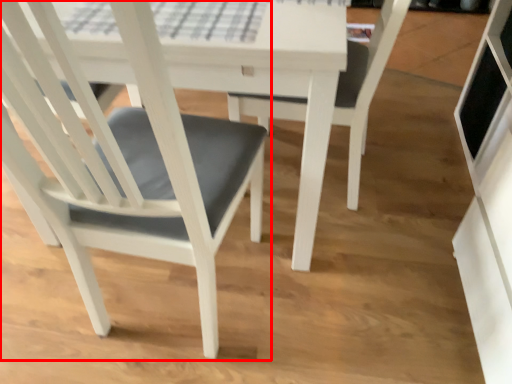
Question: From the image's perspective, where is chair (annotated by the red box) located relative to chair?

Choices:
 (A) above
 (B) below

Answer: (A)